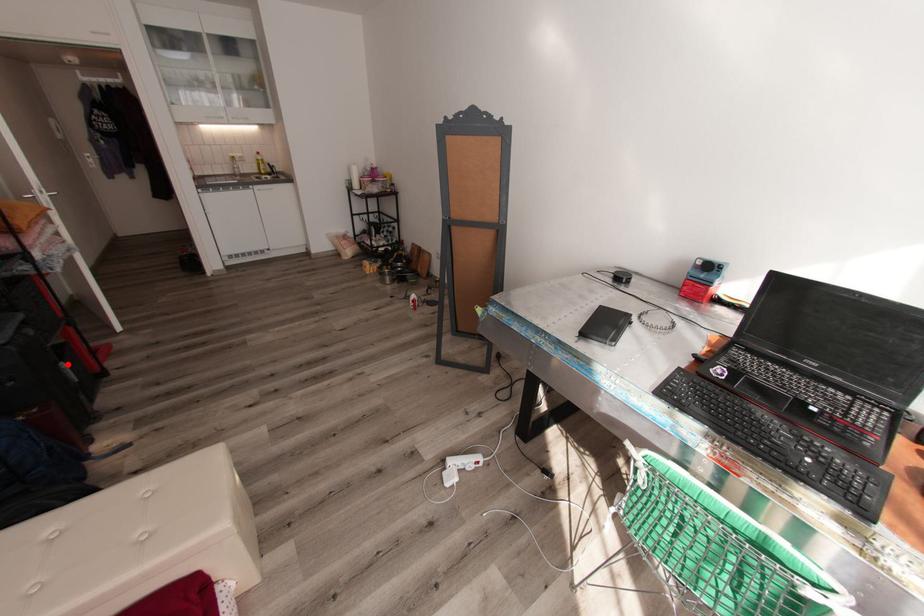
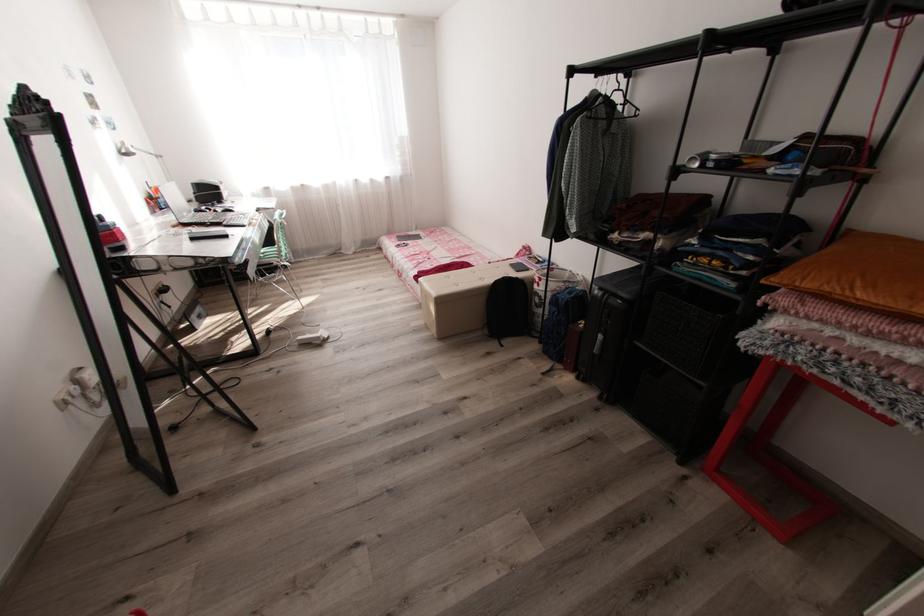
Question: I am providing you with two images of the same scene from different viewpoints. Given a red point in image1, look at the same physical point in image2. Is it:

Choices:
 (A) Closer to the viewpoint
 (B) Farther from the viewpoint

Answer: (A)